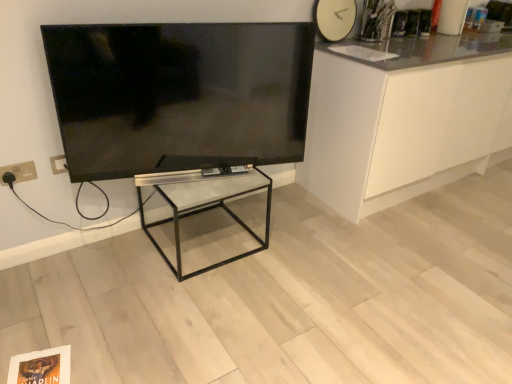
Question: Does white glossy cabinet at right have a greater width compared to clear glass table at center?

Choices:
 (A) no
 (B) yes

Answer: (B)

Question: Is clear glass table at center completely or partially inside white glossy cabinet at right?

Choices:
 (A) no
 (B) yes

Answer: (A)

Question: Does white glossy cabinet at right come in front of clear glass table at center?

Choices:
 (A) no
 (B) yes

Answer: (A)

Question: Is white glossy cabinet at right to the left of clear glass table at center from the viewer's perspective?

Choices:
 (A) yes
 (B) no

Answer: (B)

Question: Considering the relative sizes of white glossy cabinet at right and clear glass table at center in the image provided, is white glossy cabinet at right bigger than clear glass table at center?

Choices:
 (A) yes
 (B) no

Answer: (A)

Question: Is white glossy cabinet at right positioned with its back to clear glass table at center?

Choices:
 (A) no
 (B) yes

Answer: (A)

Question: Does flat screen tv at upper left have a lesser width compared to clear glass table at center?

Choices:
 (A) yes
 (B) no

Answer: (A)

Question: Is flat screen tv at upper left smaller than clear glass table at center?

Choices:
 (A) no
 (B) yes

Answer: (B)

Question: From the image's perspective, does flat screen tv at upper left appear higher than clear glass table at center?

Choices:
 (A) no
 (B) yes

Answer: (B)

Question: Is flat screen tv at upper left not close to clear glass table at center?

Choices:
 (A) yes
 (B) no

Answer: (B)

Question: Can you confirm if flat screen tv at upper left is shorter than clear glass table at center?

Choices:
 (A) yes
 (B) no

Answer: (B)

Question: From a real-world perspective, is flat screen tv at upper left positioned under clear glass table at center based on gravity?

Choices:
 (A) no
 (B) yes

Answer: (A)

Question: From the image's perspective, would you say gold metallic electric outlet at lower left is shown under white glossy cabinet at right?

Choices:
 (A) no
 (B) yes

Answer: (B)